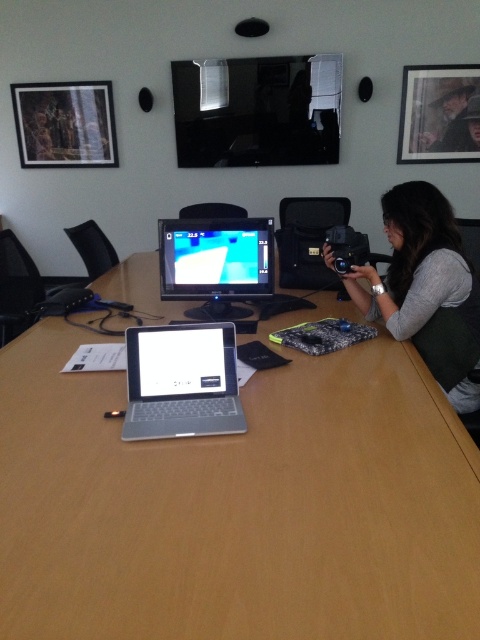
Does matte gray sweater at upper right appear under matte black camera at upper right?

Yes.

Who is higher up, matte gray sweater at upper right or matte black camera at upper right?

matte black camera at upper right

In order to click on matte gray sweater at upper right in this screenshot , I will do `click(425, 288)`.

Can you confirm if matte gray sweater at upper right is positioned to the left of matte black monitor at center?

In fact, matte gray sweater at upper right is to the right of matte black monitor at center.

Is matte gray sweater at upper right thinner than matte black monitor at center?

Yes, matte gray sweater at upper right is thinner than matte black monitor at center.

Where is `matte gray sweater at upper right`? Image resolution: width=480 pixels, height=640 pixels. matte gray sweater at upper right is located at coordinates (425, 288).

Can you confirm if wooden table at center is shorter than matte black camera at upper right?

In fact, wooden table at center may be taller than matte black camera at upper right.

Who is positioned more to the left, wooden table at center or matte black camera at upper right?

Positioned to the left is wooden table at center.

This screenshot has height=640, width=480. What do you see at coordinates (238, 506) in the screenshot?
I see `wooden table at center` at bounding box center [238, 506].

This screenshot has width=480, height=640. Find the location of `wooden table at center`. wooden table at center is located at coordinates (x=238, y=506).